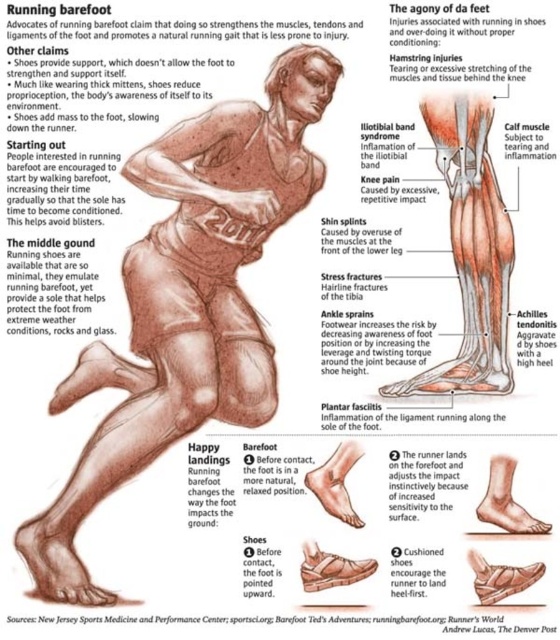
Which is more to the left, brown textured foot at lower left or matte brown shoe at lower center?

From the viewer's perspective, brown textured foot at lower left appears more on the left side.

Which of these two, brown textured foot at lower left or matte brown shoe at lower center, stands shorter?

Standing shorter between the two is matte brown shoe at lower center.

Describe the element at coordinates (58, 564) in the screenshot. The height and width of the screenshot is (640, 560). I see `brown textured foot at lower left` at that location.

This screenshot has width=560, height=640. Find the location of `brown textured foot at lower left`. brown textured foot at lower left is located at coordinates (58, 564).

Identify the location of brown textured foot at lower left. The height and width of the screenshot is (640, 560). click(58, 564).

Find the location of a particular element. This screenshot has height=640, width=560. brown textured foot at lower left is located at coordinates (58, 564).

Between brown textured paper at center and matte skin foot at lower center, which one appears on the right side from the viewer's perspective?

From the viewer's perspective, matte skin foot at lower center appears more on the right side.

Between brown textured paper at center and matte skin foot at lower center, which one has more height?

Standing taller between the two is matte skin foot at lower center.

Is point (194, 323) closer to viewer compared to point (338, 486)?

That is True.

Where is `brown textured paper at center`? brown textured paper at center is located at coordinates (199, 280).